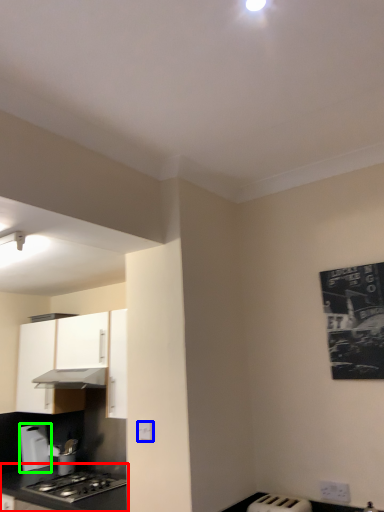
Question: Estimate the real-world distances between objects in this image. Which object is farther from countertop (highlighted by a red box), electric outlet (highlighted by a blue box) or kitchen appliance (highlighted by a green box)?

Choices:
 (A) electric outlet
 (B) kitchen appliance

Answer: (A)